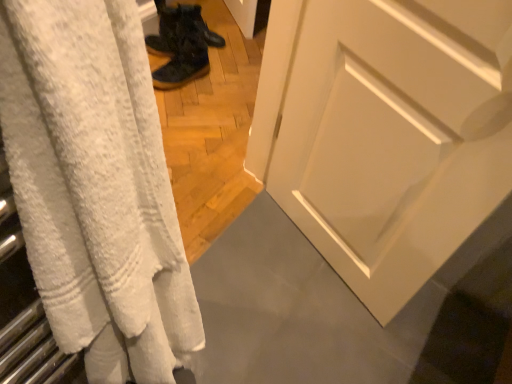
Question: Is dark matte boots at center, which is the 1th footwear from back to front, turned away from camouflage fabric boots at center, marked as the first footwear in a front-to-back arrangement?

Choices:
 (A) yes
 (B) no

Answer: (B)

Question: Is dark matte boots at center, which is the 1th footwear from back to front, positioned before camouflage fabric boots at center, the second footwear when ordered from back to front?

Choices:
 (A) no
 (B) yes

Answer: (A)

Question: Is dark matte boots at center, placed as the 2th footwear when sorted from front to back, far away from camouflage fabric boots at center, the second footwear when ordered from back to front?

Choices:
 (A) yes
 (B) no

Answer: (B)

Question: From a real-world perspective, is dark matte boots at center, placed as the 2th footwear when sorted from front to back, on top of camouflage fabric boots at center, marked as the first footwear in a front-to-back arrangement?

Choices:
 (A) yes
 (B) no

Answer: (B)

Question: Is dark matte boots at center, placed as the 2th footwear when sorted from front to back, to the right of camouflage fabric boots at center, the second footwear when ordered from back to front, from the viewer's perspective?

Choices:
 (A) yes
 (B) no

Answer: (A)

Question: In terms of height, does white textured towel at left look taller or shorter compared to camouflage fabric boots at center, the second footwear when ordered from back to front?

Choices:
 (A) tall
 (B) short

Answer: (A)

Question: In terms of width, does white textured towel at left look wider or thinner when compared to camouflage fabric boots at center, the second footwear when ordered from back to front?

Choices:
 (A) wide
 (B) thin

Answer: (B)

Question: From the image's perspective, relative to camouflage fabric boots at center, the second footwear when ordered from back to front, is white textured towel at left above or below?

Choices:
 (A) below
 (B) above

Answer: (A)

Question: From a real-world perspective, relative to camouflage fabric boots at center, the second footwear when ordered from back to front, is white textured towel at left vertically above or below?

Choices:
 (A) below
 (B) above

Answer: (B)

Question: Is white textured towel at left to the left or to the right of dark matte boots at center, placed as the 2th footwear when sorted from front to back, in the image?

Choices:
 (A) right
 (B) left

Answer: (A)

Question: From their relative heights in the image, would you say white textured towel at left is taller or shorter than dark matte boots at center, placed as the 2th footwear when sorted from front to back?

Choices:
 (A) short
 (B) tall

Answer: (B)

Question: Is white textured towel at left spatially inside dark matte boots at center, placed as the 2th footwear when sorted from front to back, or outside of it?

Choices:
 (A) inside
 (B) outside

Answer: (B)

Question: Considering the positions of point (91, 140) and point (215, 31), is point (91, 140) closer or farther from the camera than point (215, 31)?

Choices:
 (A) closer
 (B) farther

Answer: (A)

Question: Would you say dark matte boots at center, placed as the 2th footwear when sorted from front to back, is to the left or to the right of white textured towel at left in the picture?

Choices:
 (A) left
 (B) right

Answer: (A)

Question: From a real-world perspective, is dark matte boots at center, which is the 1th footwear from back to front, above or below white textured towel at left?

Choices:
 (A) below
 (B) above

Answer: (A)